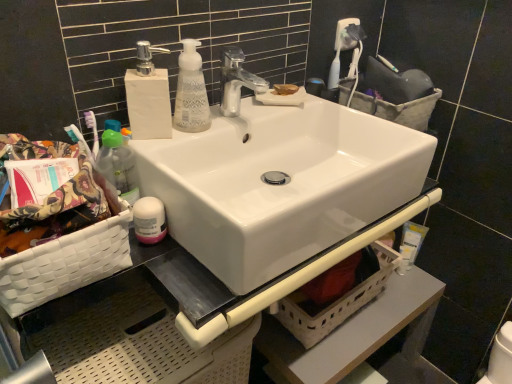
Where is `space that is in front of pink glossy lotion at lower left, positioned as the 2th toiletry in right-to-left order`? space that is in front of pink glossy lotion at lower left, positioned as the 2th toiletry in right-to-left order is located at coordinates (153, 286).